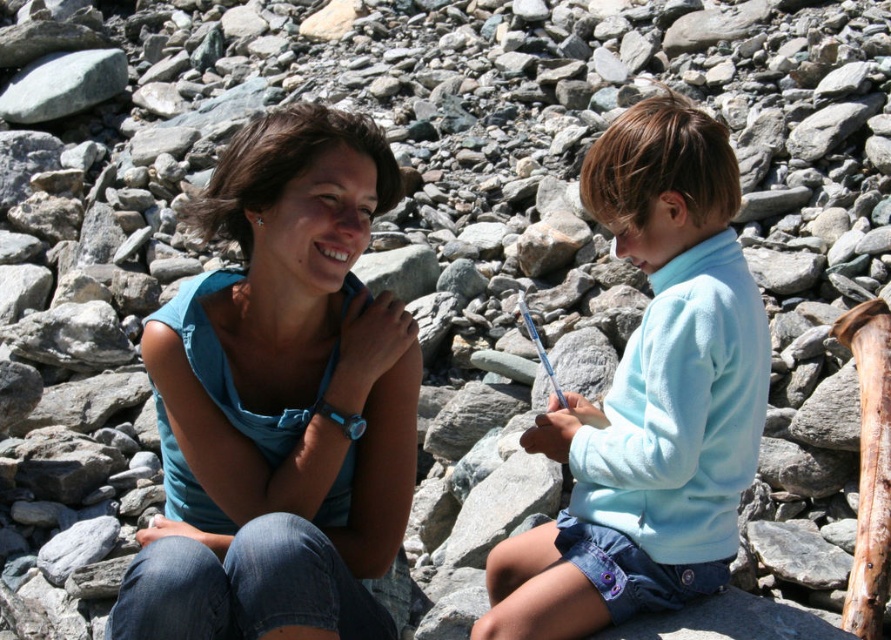
Is blue denim jeans at center to the right of light blue fleece at center from the viewer's perspective?

No, blue denim jeans at center is not to the right of light blue fleece at center.

Which is above, blue denim jeans at center or light blue fleece at center?

light blue fleece at center is higher up.

Locate an element on the screen. blue denim jeans at center is located at coordinates (280, 401).